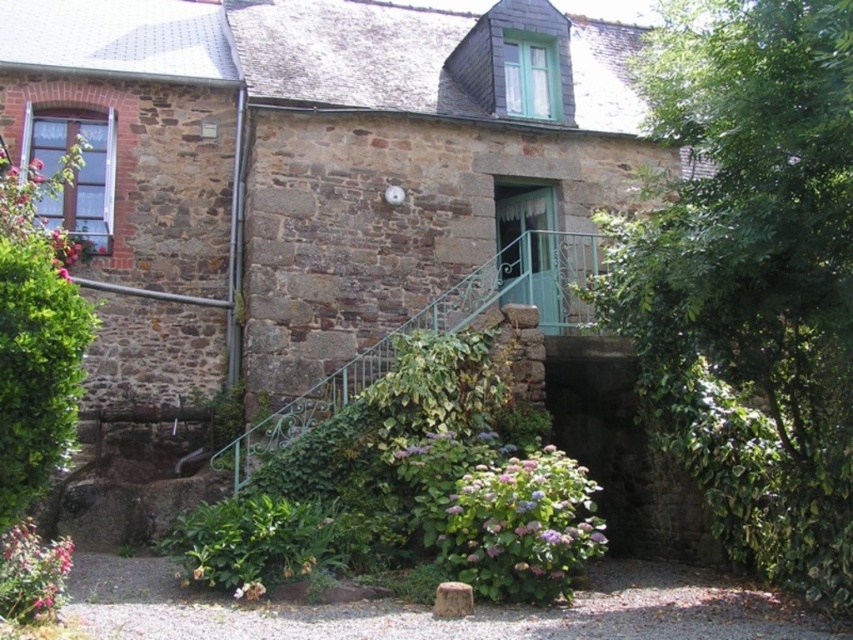
Question: Which point is closer to the camera?

Choices:
 (A) purple matte flower at lower center
 (B) pink matte flower at lower left
 (C) purple matte hydrangea at lower center

Answer: (B)

Question: Is green leafy tree at center positioned in front of purple matte hydrangea at lower center?

Choices:
 (A) yes
 (B) no

Answer: (A)

Question: Estimate the real-world distances between objects in this image. Which object is closer to the green leafy tree at center?

Choices:
 (A) green stone door at center
 (B) pink matte flower at lower left
 (C) green leafy bush at lower center

Answer: (A)

Question: Does purple matte hydrangea at lower center lie behind pink matte flower at lower left?

Choices:
 (A) no
 (B) yes

Answer: (B)

Question: Can you confirm if green leafy tree at center is thinner than green stone door at center?

Choices:
 (A) no
 (B) yes

Answer: (A)

Question: Which object is the closest to the purple matte hydrangea at lower center?

Choices:
 (A) green stone door at center
 (B) pink matte flower at lower left

Answer: (B)